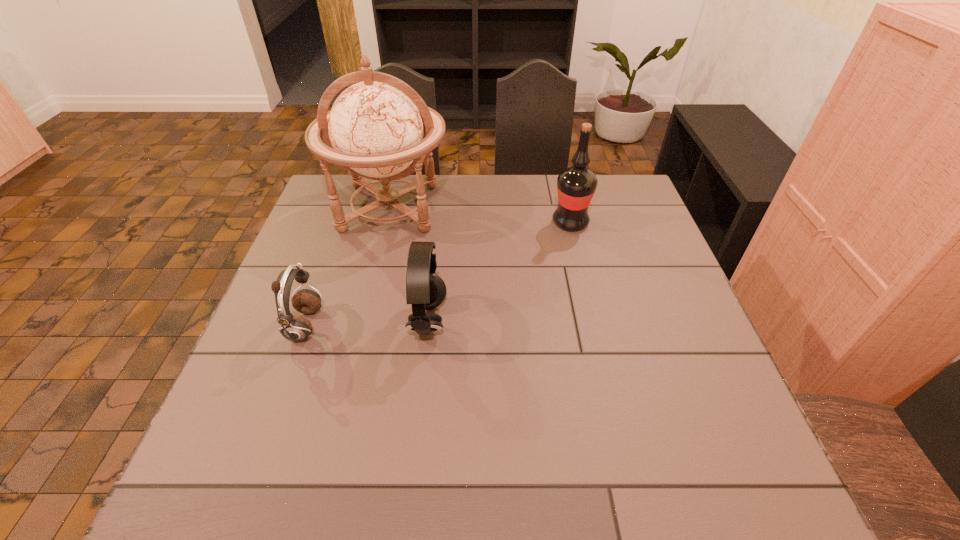
Where is `vacant area at the near left corner of the desktop`? This screenshot has height=540, width=960. vacant area at the near left corner of the desktop is located at coordinates (207, 493).

In the image, there is a desktop. Where is `vacant space at the far right corner`? This screenshot has height=540, width=960. vacant space at the far right corner is located at coordinates (640, 199).

The width and height of the screenshot is (960, 540). Find the location of `vacant area at the near right corner`. vacant area at the near right corner is located at coordinates (696, 460).

You are a GUI agent. You are given a task and a screenshot of the screen. Output one action in this format:
    pyautogui.click(x=<x>, y=<y>)
    Task: Click on the vacant area that lies between the third tallest object and the left earphone
    
    Given the screenshot: What is the action you would take?
    pyautogui.click(x=367, y=324)

The width and height of the screenshot is (960, 540). I want to click on vacant region between the globe and the left earphone, so click(x=348, y=267).

I want to click on free spot between the shorter earphone and the rightmost object, so click(x=438, y=274).

Where is `free space between the globe and the wine bottle`? Image resolution: width=960 pixels, height=540 pixels. free space between the globe and the wine bottle is located at coordinates (480, 215).

Image resolution: width=960 pixels, height=540 pixels. What are the coordinates of `vacant space that's between the taller earphone and the shortest object` in the screenshot? It's located at (x=367, y=324).

You are a GUI agent. You are given a task and a screenshot of the screen. Output one action in this format:
    pyautogui.click(x=<x>, y=<y>)
    Task: Click on the unoccupied position between the tallest object and the shortest object
    This screenshot has width=960, height=540.
    Given the screenshot: What is the action you would take?
    pyautogui.click(x=348, y=267)

I want to click on free space between the second tallest object and the left earphone, so click(438, 274).